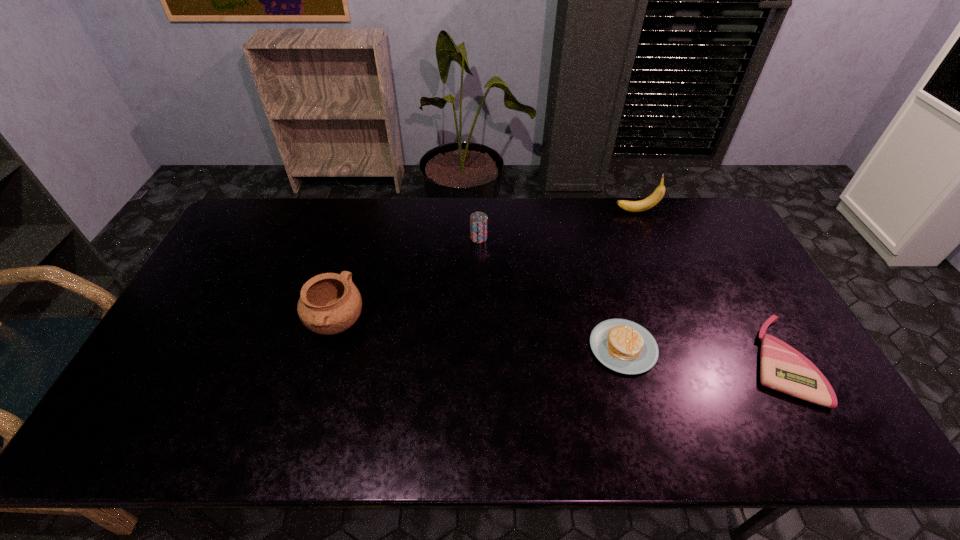
Locate an element on the screen. The image size is (960, 540). free space located 0.070m at the start of the peel on the farthest object is located at coordinates (596, 211).

Locate an element on the screen. The height and width of the screenshot is (540, 960). free region located at the start of the peel on the farthest object is located at coordinates (525, 211).

Image resolution: width=960 pixels, height=540 pixels. What are the coordinates of `vacant space located 0.080m on the right of the pottery` in the screenshot? It's located at (395, 324).

This screenshot has height=540, width=960. I want to click on vacant region located on the left of the third tallest object, so click(x=360, y=238).

I want to click on vacant space situated 0.260m on the right of the fourth tallest object, so click(753, 347).

Locate an element on the screen. This screenshot has width=960, height=540. free space located on the left of the wristlet is located at coordinates (717, 360).

Image resolution: width=960 pixels, height=540 pixels. Find the location of `banana at the far edge`. banana at the far edge is located at coordinates (632, 206).

This screenshot has height=540, width=960. In order to click on beer can that is at the far edge in this screenshot , I will do `click(478, 221)`.

This screenshot has width=960, height=540. Find the location of `object present at the right edge`. object present at the right edge is located at coordinates 782,368.

Locate an element on the screen. The width and height of the screenshot is (960, 540). blank space at the far edge of the desktop is located at coordinates (304, 236).